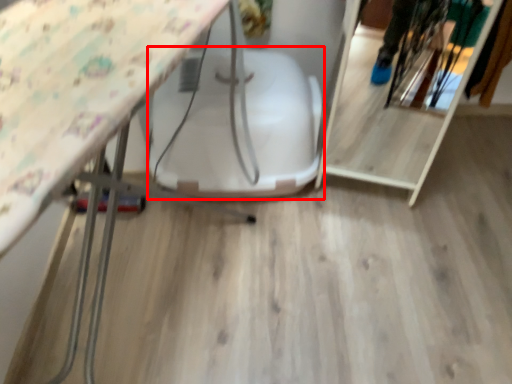
Question: Observing the image, what is the correct spatial positioning of swivel chair (annotated by the red box) in reference to shelf?

Choices:
 (A) right
 (B) left

Answer: (B)